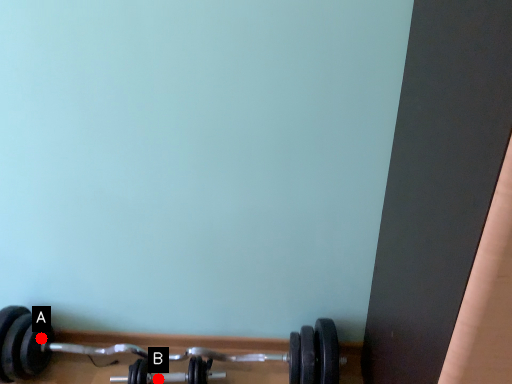
Question: Two points are circled on the image, labeled by A and B beside each circle. Which point is farther from the camera taking this photo?

Choices:
 (A) A is further
 (B) B is further

Answer: (B)